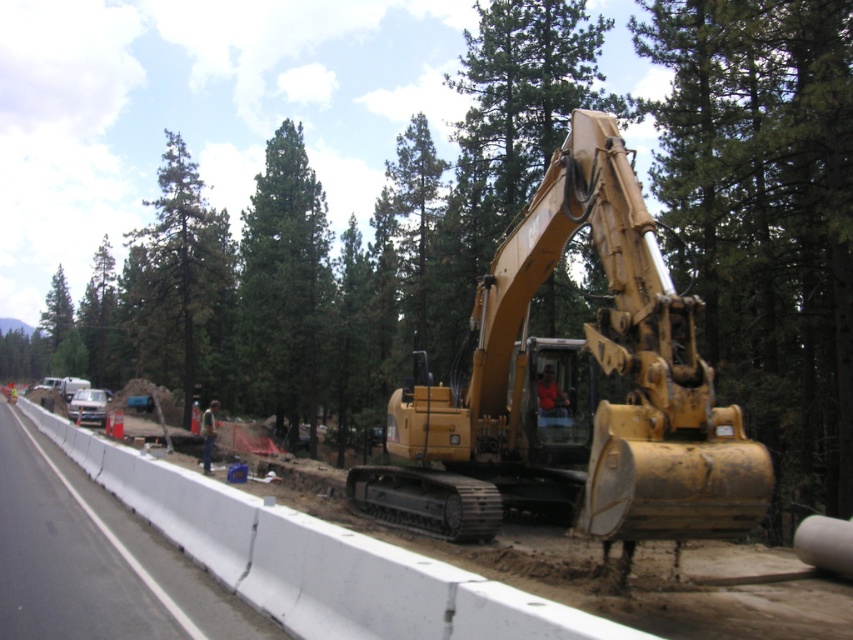
Question: Which point is closer to the camera?

Choices:
 (A) yellow metallic excavator at center
 (B) green textured tree at upper left
 (C) white concrete barrier at lower left

Answer: (C)

Question: Considering the relative positions of yellow metallic excavator at center and white concrete barrier at lower left in the image provided, where is yellow metallic excavator at center located with respect to white concrete barrier at lower left?

Choices:
 (A) above
 (B) below

Answer: (A)

Question: Which of the following is the closest to the observer?

Choices:
 (A) (299, 308)
 (B) (584, 464)
 (C) (131, 272)
 (D) (117, 628)

Answer: (D)

Question: Is yellow metallic excavator at center above green textured tree at upper left?

Choices:
 (A) no
 (B) yes

Answer: (A)

Question: Which of the following is the closest to the observer?

Choices:
 (A) white concrete barrier at lower left
 (B) yellow tracked excavator at center

Answer: (B)

Question: Is green matte tree at center smaller than green textured tree at upper left?

Choices:
 (A) no
 (B) yes

Answer: (B)